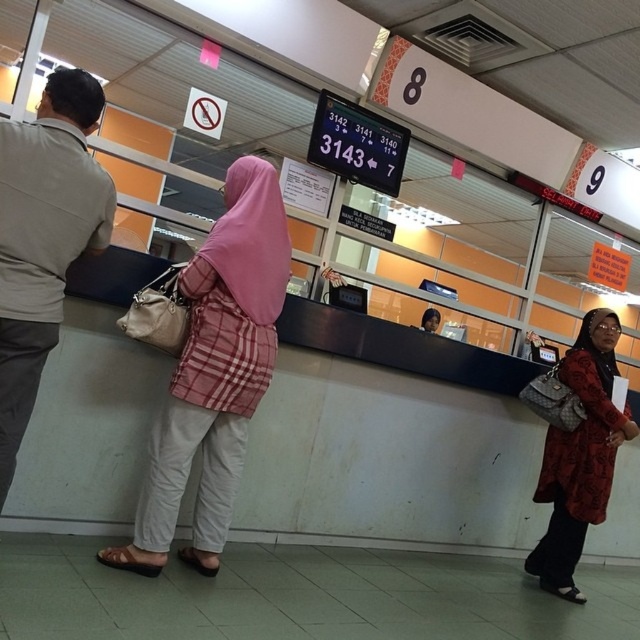
Question: Which point appears closest to the camera in this image?

Choices:
 (A) (65, 246)
 (B) (563, 401)

Answer: (A)

Question: Observing the image, what is the correct spatial positioning of beige cotton shirt at left in reference to red textured coat at lower right?

Choices:
 (A) below
 (B) above

Answer: (B)

Question: Which of the following is the farthest from the observer?

Choices:
 (A) beige cotton shirt at left
 (B) pink fabric hijab at center
 (C) red textured coat at lower right

Answer: (C)

Question: In this image, where is beige cotton shirt at left located relative to red textured coat at lower right?

Choices:
 (A) below
 (B) above

Answer: (B)

Question: Can you confirm if pink fabric hijab at center is smaller than beige cotton shirt at left?

Choices:
 (A) yes
 (B) no

Answer: (B)

Question: Among these objects, which one is nearest to the camera?

Choices:
 (A) beige cotton shirt at left
 (B) pink fabric hijab at center

Answer: (A)